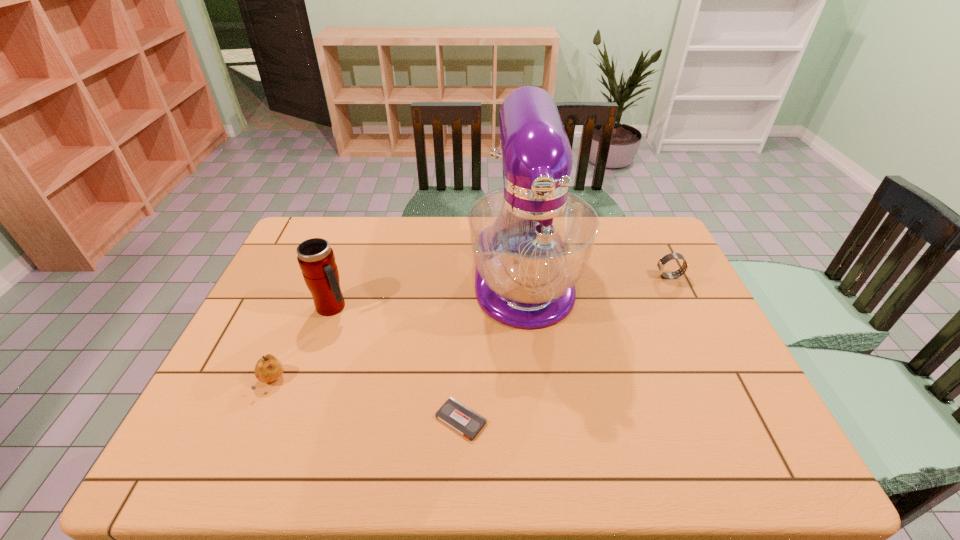
Locate an element on the screen. This screenshot has width=960, height=540. vacant space situated 0.070m on the back of the fourth farthest object is located at coordinates (287, 346).

You are a GUI agent. You are given a task and a screenshot of the screen. Output one action in this format:
    pyautogui.click(x=<x>, y=<y>)
    Task: Click on the free space located on the face of the watch
    
    Given the screenshot: What is the action you would take?
    [x=583, y=276]

Find the location of `free space located 0.100m on the face of the watch`. free space located 0.100m on the face of the watch is located at coordinates (624, 276).

Where is `vacant area situated on the face of the watch`? vacant area situated on the face of the watch is located at coordinates (564, 276).

Where is `vacant space located on the right of the videotape`? vacant space located on the right of the videotape is located at coordinates (640, 420).

I want to click on object at the far edge, so click(x=531, y=240).

Locate an element on the screen. This screenshot has height=540, width=960. object at the near edge is located at coordinates (465, 421).

This screenshot has height=540, width=960. I want to click on object present at the left edge, so [268, 368].

Where is `object that is positioned at the right edge`? The width and height of the screenshot is (960, 540). object that is positioned at the right edge is located at coordinates (661, 263).

Where is `vacant space at the far edge`? The height and width of the screenshot is (540, 960). vacant space at the far edge is located at coordinates (420, 254).